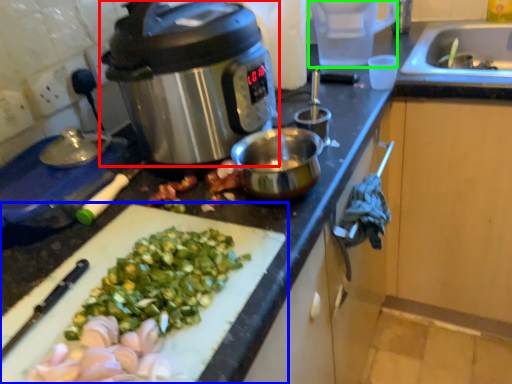
Question: Which object is positioned closest to slow cooker (highlighted by a red box)? Select from cutting board (highlighted by a blue box) and appliance (highlighted by a green box).

Choices:
 (A) cutting board
 (B) appliance

Answer: (A)